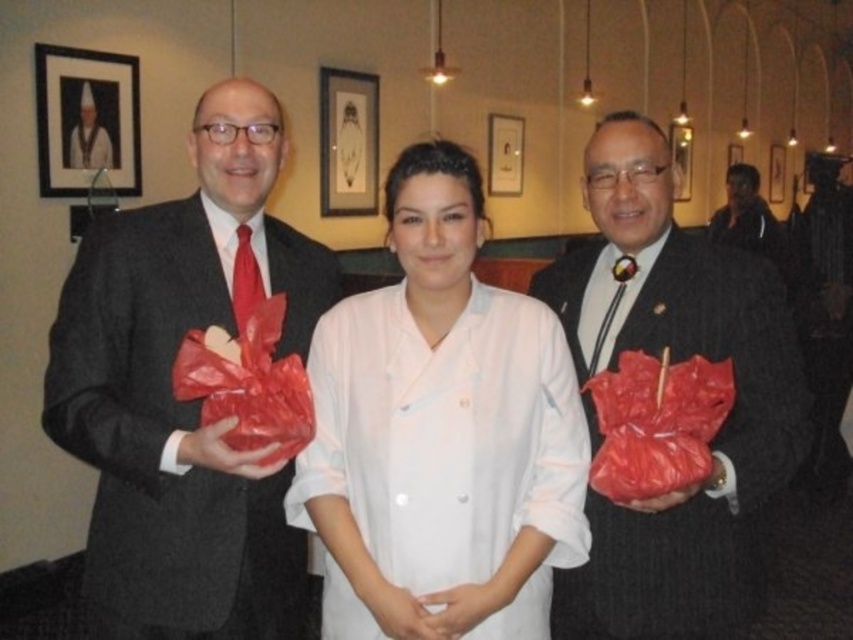
Does white smooth uniform at center appear over matte black suit at right?

Yes.

Is white smooth uniform at center smaller than matte black suit at right?

Yes.

Which is in front, point (422, 173) or point (735, 442)?

Point (422, 173)

Locate an element on the screen. white smooth uniform at center is located at coordinates (440, 433).

Describe the element at coordinates (184, 401) in the screenshot. I see `matte black suit at left` at that location.

Identify the location of matte black suit at left. (184, 401).

I want to click on matte black suit at left, so click(184, 401).

Who is taller, white smooth uniform at center or black fabric jacket at upper right?

white smooth uniform at center

Is white smooth uniform at center wider than black fabric jacket at upper right?

Correct, the width of white smooth uniform at center exceeds that of black fabric jacket at upper right.

Between point (309, 467) and point (712, 216), which one is positioned behind?

The point (712, 216) is more distant.

Locate an element on the screen. white smooth uniform at center is located at coordinates (440, 433).